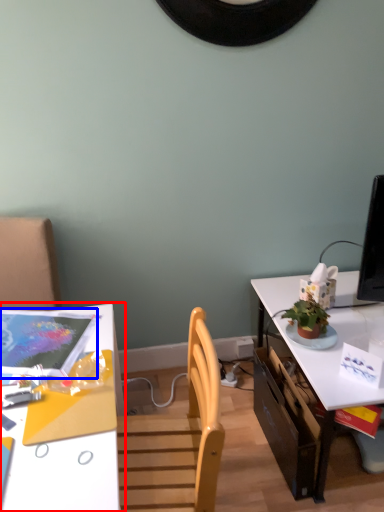
Question: Which object is further to the camera taking this photo, desk (highlighted by a red box) or magazine (highlighted by a blue box)?

Choices:
 (A) desk
 (B) magazine

Answer: (B)